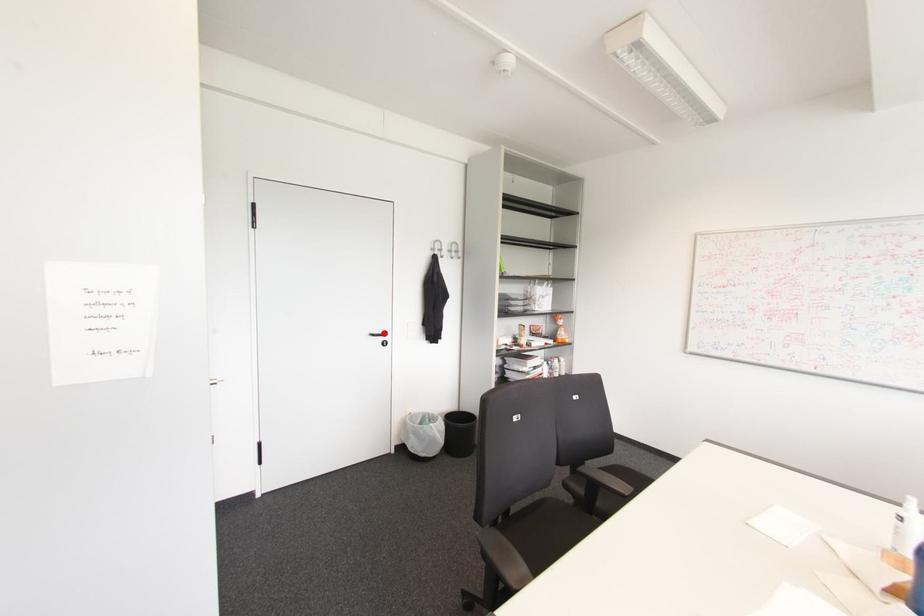
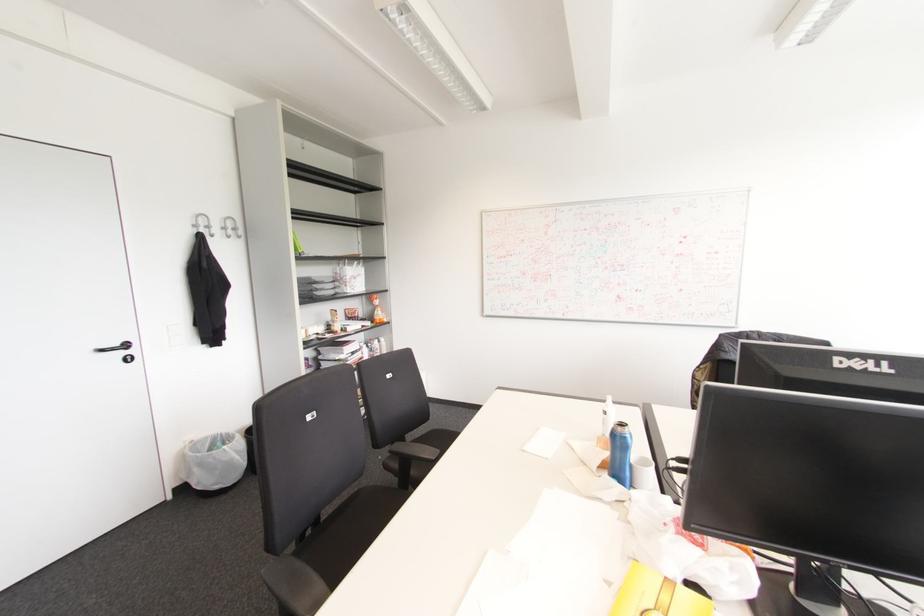
Locate, in the second image, the point that corresponds to the highlighted location in the first image.

(126, 345)